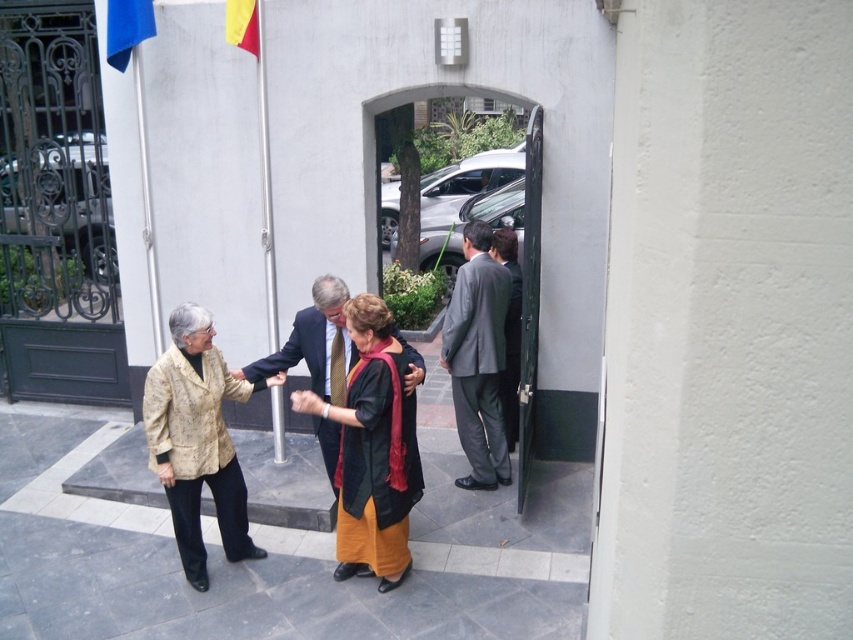
Question: Which point is closer to the camera?

Choices:
 (A) (477, 346)
 (B) (521, 356)

Answer: (B)

Question: Where is dark green fabric coat at center located in relation to yellow fabric flag at upper left in the image?

Choices:
 (A) left
 (B) right

Answer: (B)

Question: Which point appears closest to the camera in this image?

Choices:
 (A) (190, 358)
 (B) (531, 429)

Answer: (A)

Question: Where is dark green fabric coat at center located in relation to blue fabric flag at upper left in the image?

Choices:
 (A) right
 (B) left

Answer: (A)

Question: Which point appears farthest from the camera in this image?

Choices:
 (A) (129, 35)
 (B) (379, 310)
 (C) (229, 518)

Answer: (A)

Question: Is gray suit at right to the left of green matte door at center from the viewer's perspective?

Choices:
 (A) yes
 (B) no

Answer: (A)